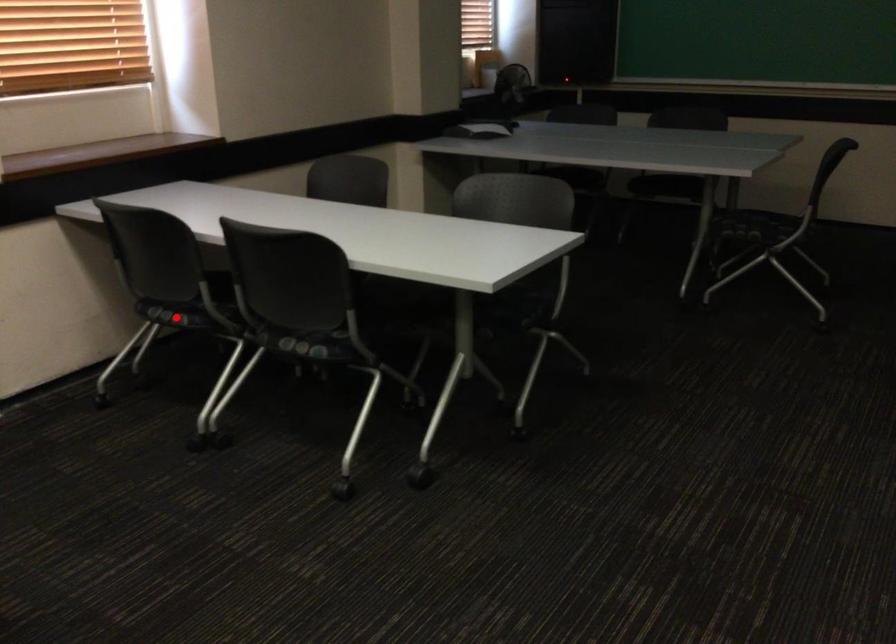
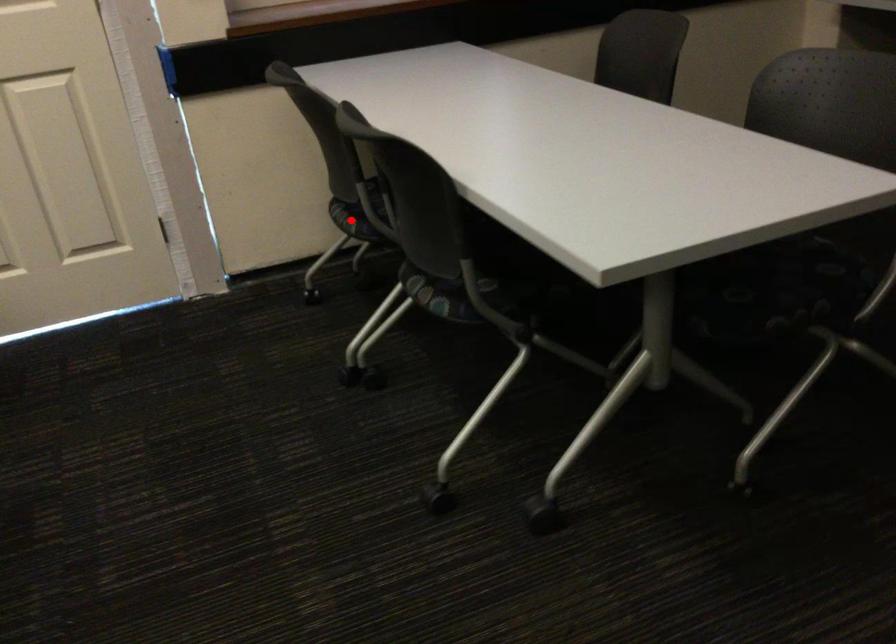
I am providing you with two images of the same scene from different viewpoints. A red point is marked on the first image and another point is marked on the second image. Are the points marked in image1 and image2 representing the same 3D position?

Yes